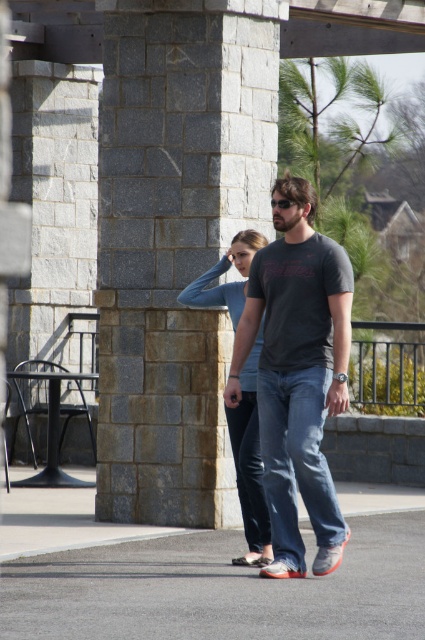
Does gray asphalt at lower center appear over dark gray t-shirt at center?

No.

Which is more to the right, gray asphalt at lower center or dark gray t-shirt at center?

From the viewer's perspective, dark gray t-shirt at center appears more on the right side.

Is point (107, 573) closer to viewer compared to point (258, 314)?

Yes, it is in front of point (258, 314).

Where is `gray asphalt at lower center`? The image size is (425, 640). gray asphalt at lower center is located at coordinates (218, 589).

Which is more to the right, denim at center or light blue denim jeans at center?

denim at center

How far apart are denim at center and light blue denim jeans at center?

denim at center is 22.42 inches away from light blue denim jeans at center.

Does point (269, 451) come behind point (252, 352)?

No, (269, 451) is closer to viewer.

Where is `denim at center`? The image size is (425, 640). denim at center is located at coordinates (297, 468).

What do you see at coordinates (175, 241) in the screenshot? I see `gray stone pillar at center` at bounding box center [175, 241].

Does point (155, 305) lie behind point (243, 509)?

That is True.

The height and width of the screenshot is (640, 425). Describe the element at coordinates (175, 241) in the screenshot. I see `gray stone pillar at center` at that location.

Image resolution: width=425 pixels, height=640 pixels. Identify the location of gray stone pillar at center. (175, 241).